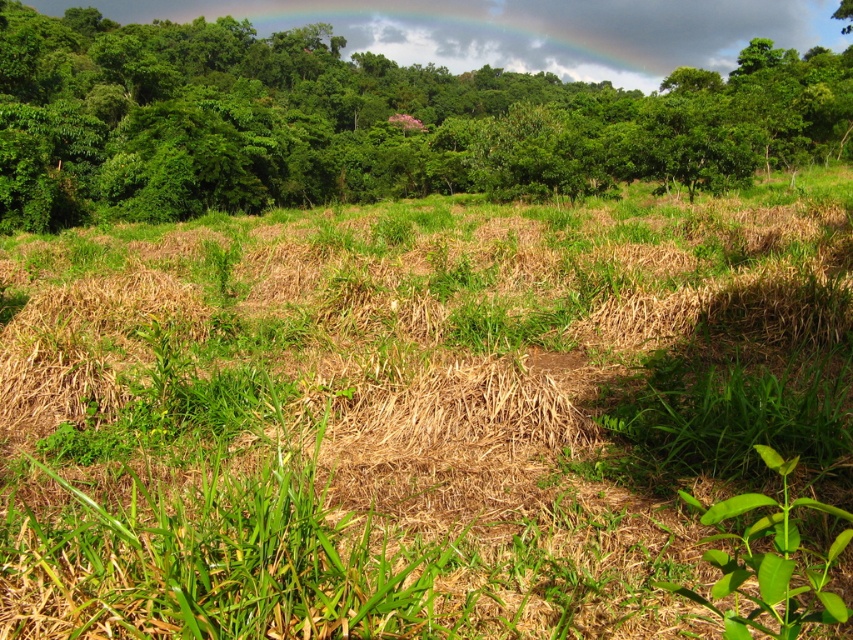
Which is more to the left, green grassy field at center or green leafy tree at upper center?

green leafy tree at upper center

Looking at this image, who is taller, green grassy field at center or green leafy tree at upper center?

With more height is green leafy tree at upper center.

At what (x,y) coordinates should I click in order to perform the action: click on green grassy field at center. Please return your answer as a coordinate pair (x, y). Looking at the image, I should click on (428, 419).